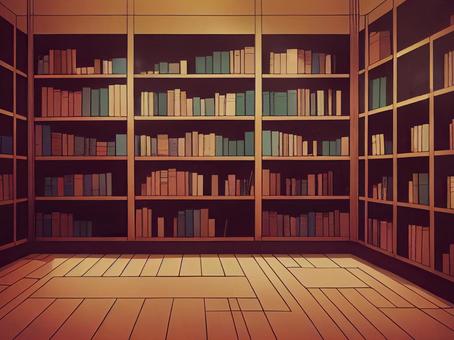
At what (x,y) coordinates should I click in order to perform the action: click on column cubbies adjacent walls. Please return your answer as a coordinate pair (x, y). Looking at the image, I should click on (19, 46), (19, 97), (21, 143), (23, 182), (21, 218), (359, 212), (364, 178), (359, 83), (362, 46).